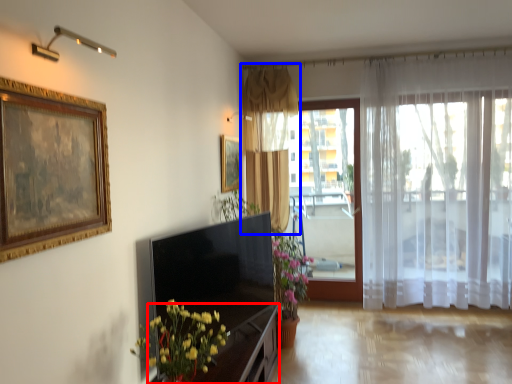
Question: Among these objects, which one is nearest to the camera, dresser (highlighted by a red box) or curtain (highlighted by a blue box)?

Choices:
 (A) dresser
 (B) curtain

Answer: (A)